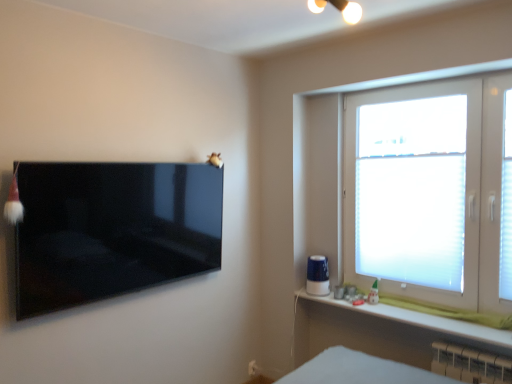
Locate an element on the screen. This screenshot has width=512, height=384. blank space above white frosted glass window at right (from a real-world perspective) is located at coordinates click(423, 83).